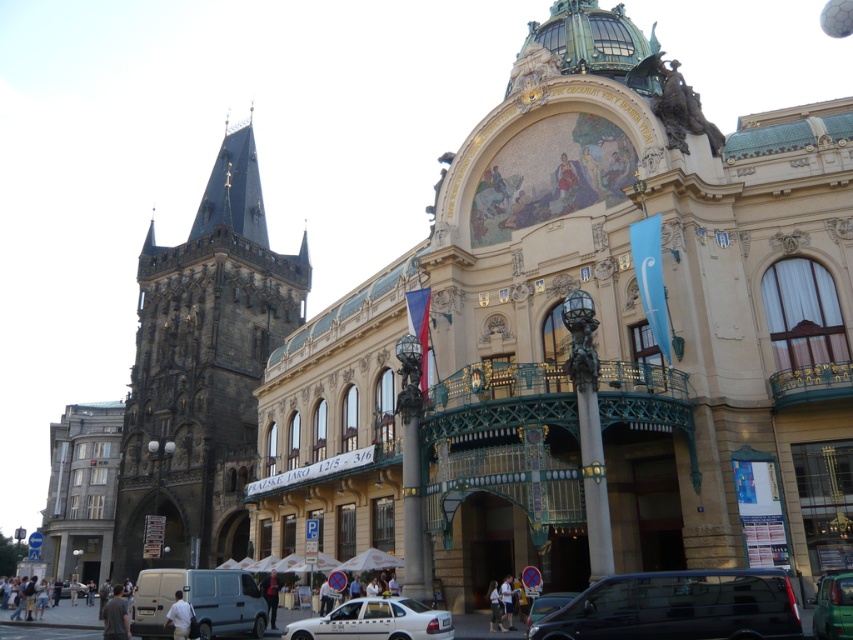
Question: Is silver metallic van at lower left further to camera compared to light beige fabric pants at lower center?

Choices:
 (A) no
 (B) yes

Answer: (A)

Question: Observing the image, what is the correct spatial positioning of silver metallic van at lower left in reference to light beige fabric pants at lower center?

Choices:
 (A) below
 (B) above

Answer: (A)

Question: Can you confirm if white shirt at lower left is bigger than light beige fabric pants at lower center?

Choices:
 (A) yes
 (B) no

Answer: (B)

Question: Which point is farther to the camera?

Choices:
 (A) light brown leather jacket at lower center
 (B) white glossy taxi at lower center
 (C) light beige fabric pants at lower center

Answer: (A)

Question: Which of the following is the closest to the observer?

Choices:
 (A) white glossy taxi at lower center
 (B) dark brown stone tower at left
 (C) beige stone church at center

Answer: (A)

Question: Which of these objects is positioned closest to the metallic silver car at lower center?

Choices:
 (A) light beige fabric pants at lower center
 (B) light brown leather jacket at lower center
 (C) dark blue jeans at lower center
 (D) silver metallic van at lower left

Answer: (A)